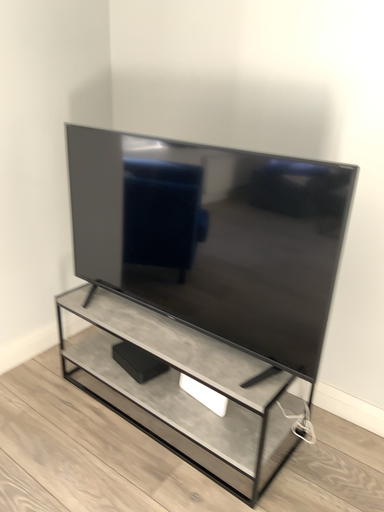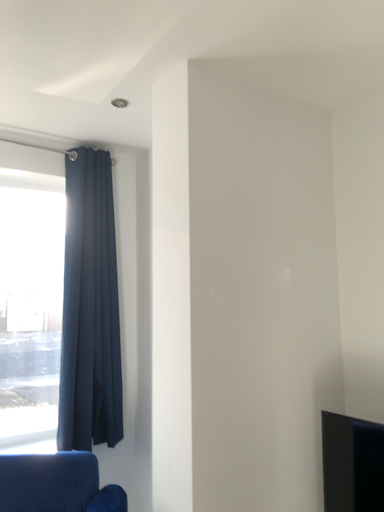
Question: How did the camera likely rotate when shooting the video?

Choices:
 (A) rotated left
 (B) rotated right

Answer: (A)